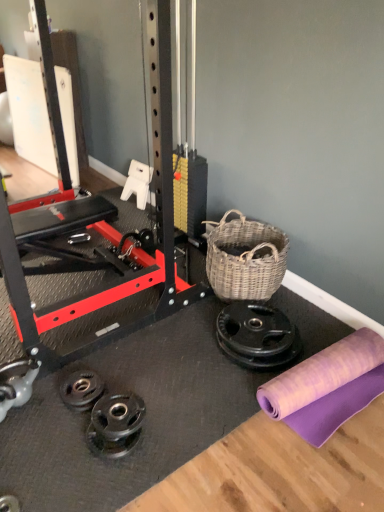
Locate an element on the screen. vacant space underneath black rubber weight plate at lower left (from a real-world perspective) is located at coordinates (81, 396).